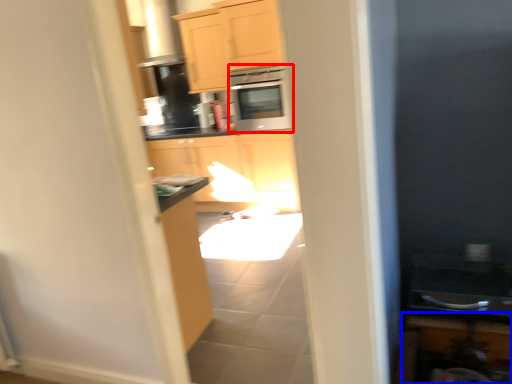
Question: Among these objects, which one is farthest to the camera, microwave oven (highlighted by a red box) or cabinetry (highlighted by a blue box)?

Choices:
 (A) microwave oven
 (B) cabinetry

Answer: (A)